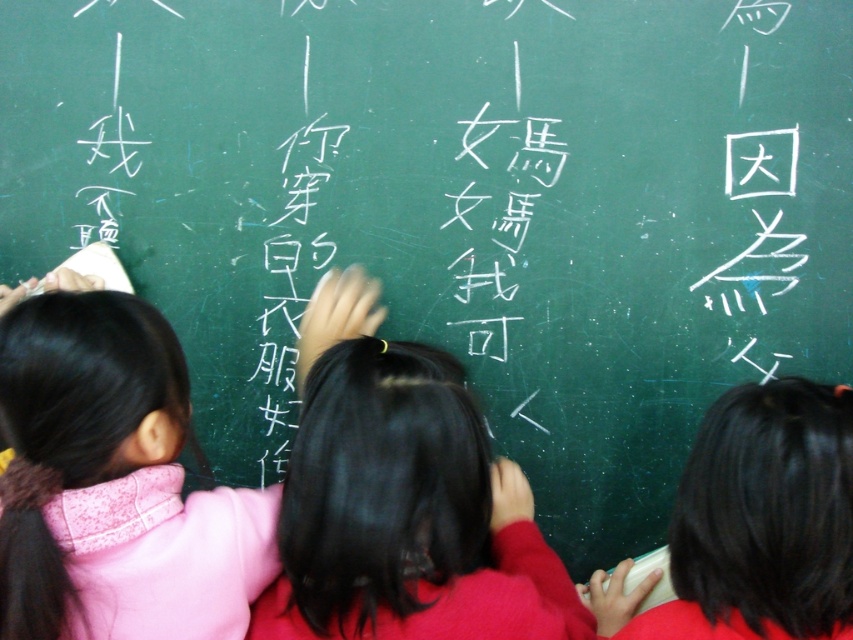
Between pink fabric at left and black hair at right, which one appears on the right side from the viewer's perspective?

black hair at right

Measure the distance from pink fabric at left to black hair at right.

A distance of 23.89 inches exists between pink fabric at left and black hair at right.

Identify the location of pink fabric at left. (167, 536).

Identify the location of pink fabric at left. Image resolution: width=853 pixels, height=640 pixels. coord(167,536).